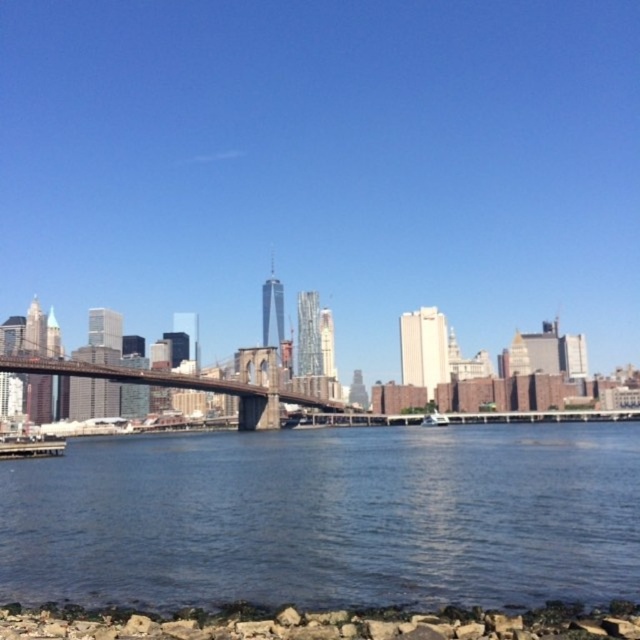
Question: Is blue water at lower center positioned behind brown wooden bridge at center?

Choices:
 (A) no
 (B) yes

Answer: (A)

Question: Considering the relative positions of blue water at lower center and rocks at lower center in the image provided, where is blue water at lower center located with respect to rocks at lower center?

Choices:
 (A) below
 (B) above

Answer: (A)

Question: Which object is positioned farthest from the blue water at lower center?

Choices:
 (A) rocks at lower center
 (B) brown wooden bridge at center

Answer: (B)

Question: Does blue water at lower center appear under rocks at lower center?

Choices:
 (A) yes
 (B) no

Answer: (A)

Question: Which of the following is the farthest from the observer?

Choices:
 (A) rocks at lower center
 (B) brown wooden bridge at center
 (C) blue water at lower center

Answer: (B)

Question: Among these objects, which one is nearest to the camera?

Choices:
 (A) brown wooden bridge at center
 (B) rocks at lower center

Answer: (B)